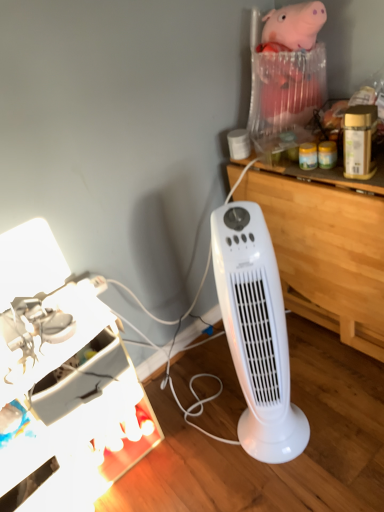
What are the coordinates of `white plastic tower fan at center` in the screenshot? It's located at (256, 332).

Between wooden at right and white plastic tower fan at center, which one appears on the left side from the viewer's perspective?

Positioned to the left is white plastic tower fan at center.

Does point (373, 217) lie behind point (282, 313)?

Yes.

Does wooden at right touch white plastic tower fan at center?

No, wooden at right is not making contact with white plastic tower fan at center.

From the image's perspective, between white plastic tower fan at center and metallic silver desk lamp at lower left, who is located below?

metallic silver desk lamp at lower left appears lower in the image.

From a real-world perspective, which object rests below the other?

From a 3D spatial view, metallic silver desk lamp at lower left is below.

Choose the correct answer: Is white plastic tower fan at center inside metallic silver desk lamp at lower left or outside it?

The correct answer is: outside.

From the picture: Considering the sizes of objects white plastic tower fan at center and metallic silver desk lamp at lower left in the image provided, who is wider, white plastic tower fan at center or metallic silver desk lamp at lower left?

metallic silver desk lamp at lower left is wider.

Is wooden at right taller or shorter than metallic silver desk lamp at lower left?

In the image, wooden at right appears to be taller than metallic silver desk lamp at lower left.

From the image's perspective, is wooden at right on metallic silver desk lamp at lower left?

Yes.

Does wooden at right lie in front of metallic silver desk lamp at lower left?

No, the depth of wooden at right is greater than that of metallic silver desk lamp at lower left.

How many degrees apart are the facing directions of metallic silver desk lamp at lower left and wooden at right?

There is a 88.2-degree angle between the facing directions of metallic silver desk lamp at lower left and wooden at right.

Considering the sizes of objects metallic silver desk lamp at lower left and wooden at right in the image provided, who is shorter, metallic silver desk lamp at lower left or wooden at right?

With less height is metallic silver desk lamp at lower left.

Considering the sizes of metallic silver desk lamp at lower left and wooden at right in the image, is metallic silver desk lamp at lower left bigger or smaller than wooden at right?

metallic silver desk lamp at lower left is smaller than wooden at right.

From the image's perspective, which is below, metallic silver desk lamp at lower left or wooden at right?

metallic silver desk lamp at lower left appears lower in the image.

Between metallic silver desk lamp at lower left and white plastic tower fan at center, which one has less height?

metallic silver desk lamp at lower left is shorter.

Choose the correct answer: Is metallic silver desk lamp at lower left inside white plastic tower fan at center or outside it?

metallic silver desk lamp at lower left is not enclosed by white plastic tower fan at center.

Is metallic silver desk lamp at lower left behind white plastic tower fan at center?

That is True.

Looking at this image, between metallic silver desk lamp at lower left and white plastic tower fan at center, which one has larger width?

metallic silver desk lamp at lower left.

Looking at this image, could you tell me if white plastic tower fan at center is facing wooden at right?

No, white plastic tower fan at center is not turned towards wooden at right.

Does white plastic tower fan at center appear on the right side of wooden at right?

In fact, white plastic tower fan at center is to the left of wooden at right.

Is white plastic tower fan at center far away from wooden at right?

No.

Can you confirm if white plastic tower fan at center is shorter than wooden at right?

No, white plastic tower fan at center is not shorter than wooden at right.

The height and width of the screenshot is (512, 384). I want to click on computer desk behind the white plastic tower fan at center, so click(x=326, y=253).

Locate an element on the screen. home appliance in front of the metallic silver desk lamp at lower left is located at coordinates (256, 332).

Which object lies further to the anchor point white plastic tower fan at center, wooden at right or metallic silver desk lamp at lower left?

Among the two, metallic silver desk lamp at lower left is located further to white plastic tower fan at center.

Based on their spatial positions, is metallic silver desk lamp at lower left or wooden at right further from white plastic tower fan at center?

Based on the image, metallic silver desk lamp at lower left appears to be further to white plastic tower fan at center.

Looking at the image, which one is located closer to wooden at right, metallic silver desk lamp at lower left or white plastic tower fan at center?

The object closer to wooden at right is white plastic tower fan at center.

Which object lies further to the anchor point wooden at right, white plastic tower fan at center or metallic silver desk lamp at lower left?

Based on the image, metallic silver desk lamp at lower left appears to be further to wooden at right.

Which object lies nearer to the anchor point metallic silver desk lamp at lower left, wooden at right or white plastic tower fan at center?

white plastic tower fan at center lies closer to metallic silver desk lamp at lower left than the other object.

Which object lies nearer to the anchor point metallic silver desk lamp at lower left, white plastic tower fan at center or wooden at right?

The object closer to metallic silver desk lamp at lower left is white plastic tower fan at center.

Identify the location of home appliance located between metallic silver desk lamp at lower left and wooden at right in the left-right direction. (256, 332).